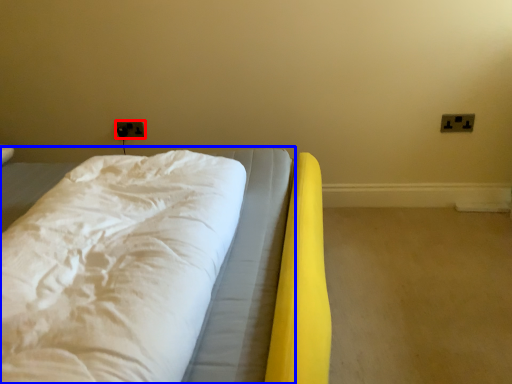
Question: Which point is further to the camera, electric outlet (highlighted by a red box) or bed (highlighted by a blue box)?

Choices:
 (A) electric outlet
 (B) bed

Answer: (A)